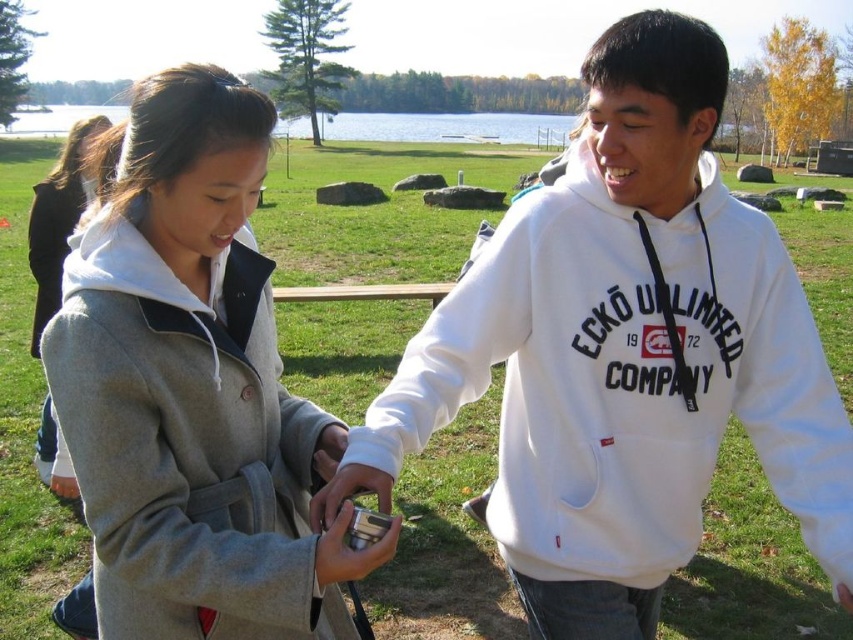
You are a photographer trying to capture a clear photo of the metallic silver camera at center. The gray wool coat at center is blocking your view. Can you move around to the left or right side to get an unobstructed shot?

The gray wool coat at center is further to the viewer than the metallic silver camera at center, so moving to the left or right side might allow you to go around the coat and get an unobstructed view of the camera.